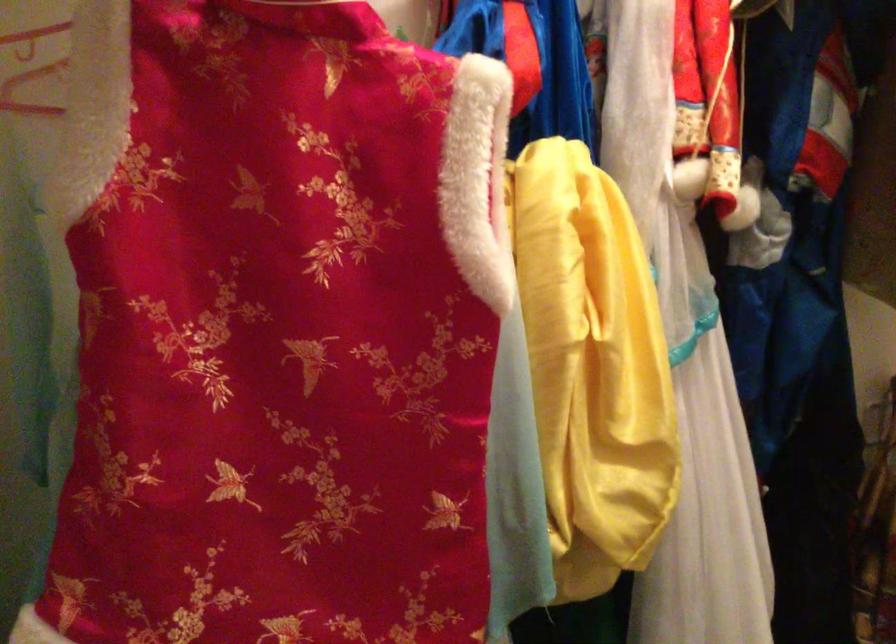
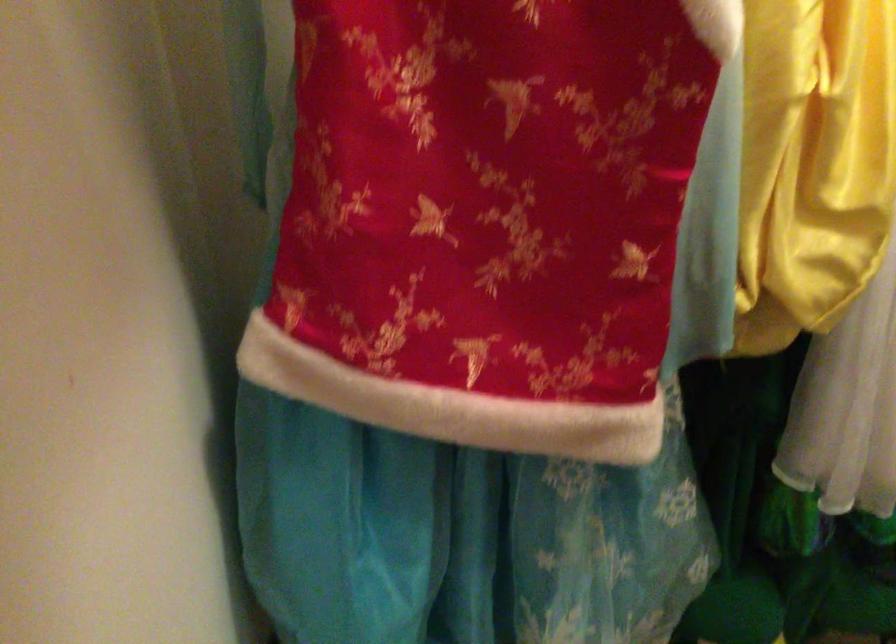
Question: How did the camera likely rotate?

Choices:
 (A) Left
 (B) Right
 (C) Up
 (D) Down

Answer: (D)